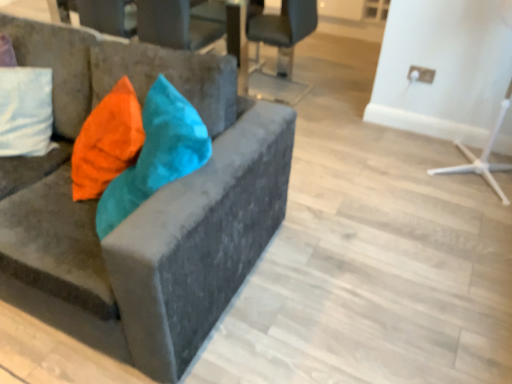
Question: From the image's perspective, is metallic gray chair at upper center, arranged as the second chair when viewed from the front, located above or below velvet orange pillow at left?

Choices:
 (A) below
 (B) above

Answer: (B)

Question: Is metallic gray chair at upper center, arranged as the second chair when viewed from the front, taller or shorter than velvet orange pillow at left?

Choices:
 (A) short
 (B) tall

Answer: (B)

Question: Estimate the real-world distances between objects in this image. Which object is closer to the matte black chair at upper center, which is the third chair from front to back?

Choices:
 (A) velvet cushion at upper left, placed as the 1th chair when sorted from front to back
 (B) velvet orange pillow at left
 (C) metallic gray chair at upper center, arranged as the second chair when viewed from the front

Answer: (C)

Question: Which is farther from the metallic gray chair at upper center, arranged as the second chair when viewed from the front?

Choices:
 (A) matte black chair at upper center, which ranks as the first chair in back-to-front order
 (B) velvet cushion at upper left, placed as the 1th chair when sorted from front to back
 (C) velvet orange pillow at left

Answer: (B)